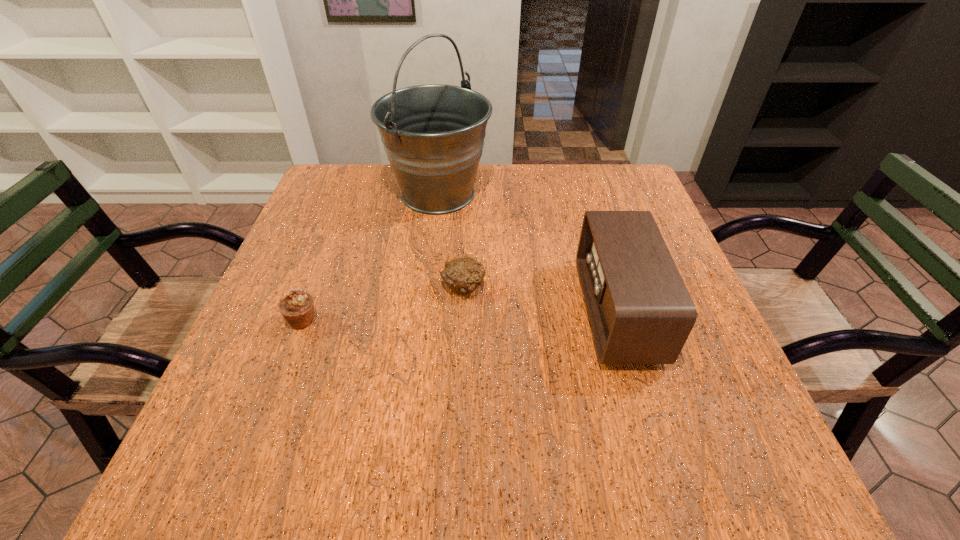
Identify the location of vacant space at the right edge of the desktop. The width and height of the screenshot is (960, 540). (703, 413).

I want to click on vacant region at the far right corner, so click(x=642, y=199).

At what (x,y) coordinates should I click in order to perform the action: click on vacant space at the near right corner of the desktop. Please return your answer as a coordinate pair (x, y). Looking at the image, I should click on (733, 438).

Identify the location of free spot between the radio receiver and the farther muffin. The width and height of the screenshot is (960, 540). (540, 300).

You are a GUI agent. You are given a task and a screenshot of the screen. Output one action in this format:
    pyautogui.click(x=<x>, y=<y>)
    Task: Click on the free point between the farther muffin and the tallest object
    The height and width of the screenshot is (540, 960).
    Given the screenshot: What is the action you would take?
    pyautogui.click(x=450, y=240)

The height and width of the screenshot is (540, 960). I want to click on vacant space that's between the leftmost object and the radio receiver, so click(x=460, y=316).

Locate an element on the screen. The image size is (960, 540). free spot between the bucket and the second tallest object is located at coordinates (528, 253).

Locate an element on the screen. empty space that is in between the rightmost object and the farther muffin is located at coordinates (540, 300).

Locate an element on the screen. This screenshot has height=540, width=960. vacant point located between the bucket and the right muffin is located at coordinates (450, 240).

Where is `free space between the farthest object and the rightmost object`? free space between the farthest object and the rightmost object is located at coordinates (528, 253).